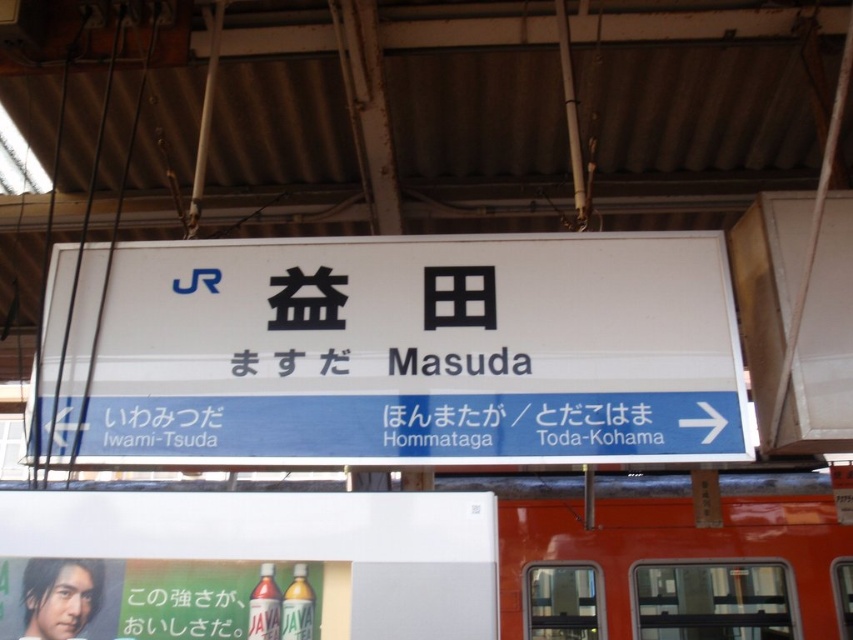
Which is more to the right, white matte signboard at center or matte plastic bottle at lower center?

Positioned to the right is white matte signboard at center.

How much distance is there between white matte signboard at center and matte plastic bottle at lower center?

21.75 inches

This screenshot has height=640, width=853. What are the coordinates of `white matte signboard at center` in the screenshot? It's located at (396, 352).